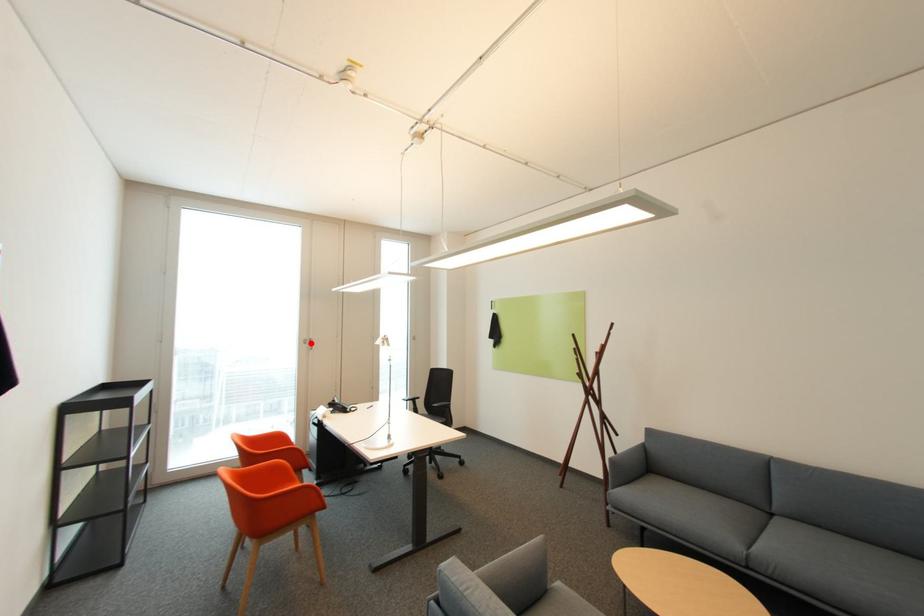
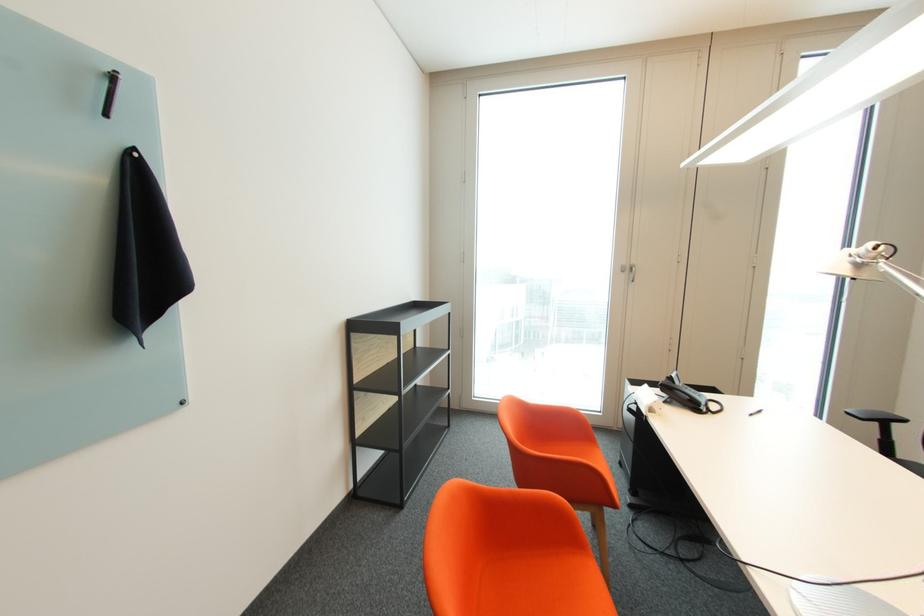
In the second image, find the point that corresponds to the highlighted location in the first image.

(629, 272)